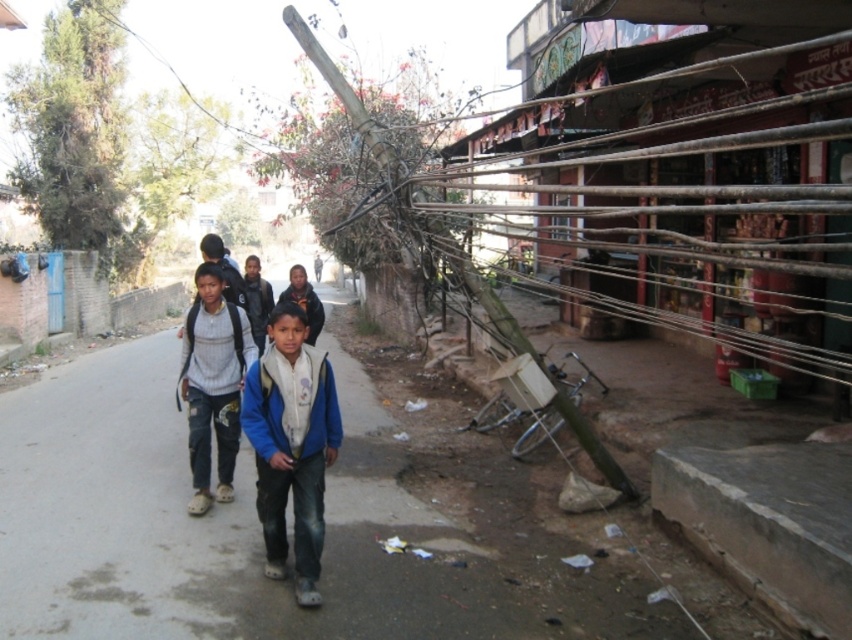
Question: Does blue fleece jacket at center lie behind knitted sweater at center?

Choices:
 (A) no
 (B) yes

Answer: (A)

Question: Can you confirm if blue fleece jacket at center is positioned to the left of knitted sweater at center?

Choices:
 (A) no
 (B) yes

Answer: (A)

Question: In this image, where is blue fleece jacket at center located relative to knitted sweater at center?

Choices:
 (A) right
 (B) left

Answer: (A)

Question: Which of the following is the closest to the observer?

Choices:
 (A) blue fleece jacket at center
 (B) knitted sweater at center

Answer: (A)